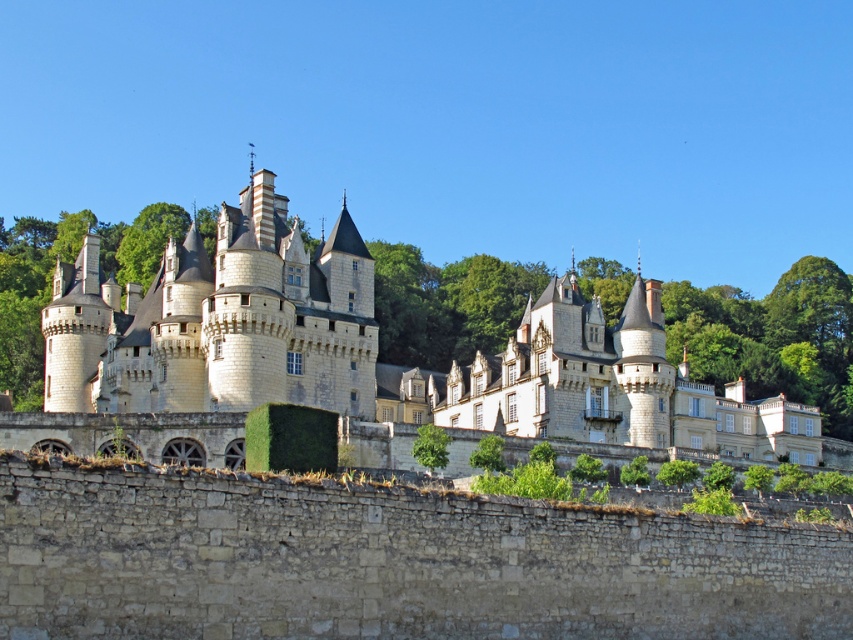
Question: Which object appears farthest from the camera in this image?

Choices:
 (A) white stone castle at center
 (B) gray stone wall at lower center

Answer: (A)

Question: Where is white stone castle at center located in relation to gray stone wall at lower center in the image?

Choices:
 (A) above
 (B) below

Answer: (A)

Question: Which point is farther to the camera?

Choices:
 (A) (705, 355)
 (B) (315, 529)

Answer: (A)

Question: Does white stone castle at center appear under gray stone wall at lower center?

Choices:
 (A) no
 (B) yes

Answer: (A)

Question: Can you confirm if white stone castle at center is bigger than gray stone wall at lower center?

Choices:
 (A) yes
 (B) no

Answer: (A)